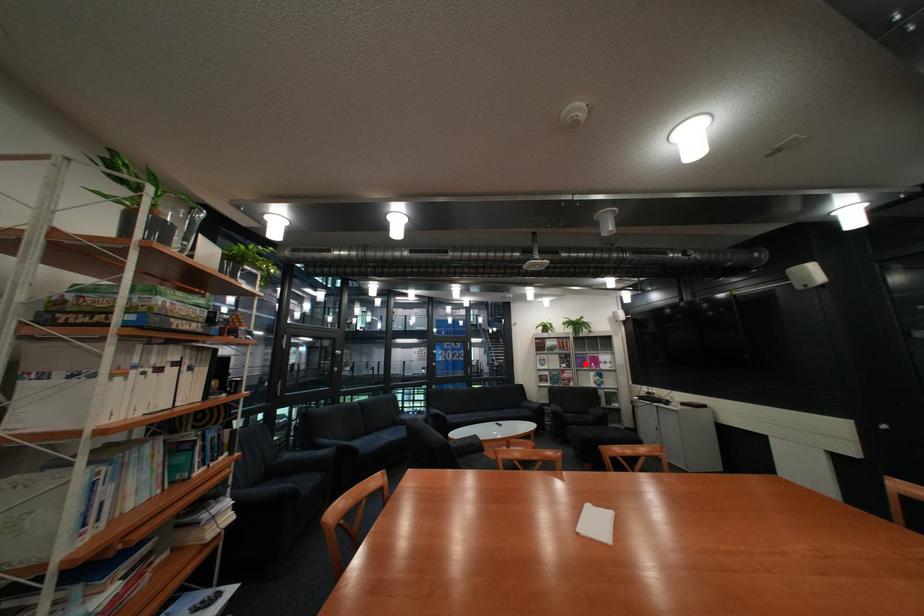
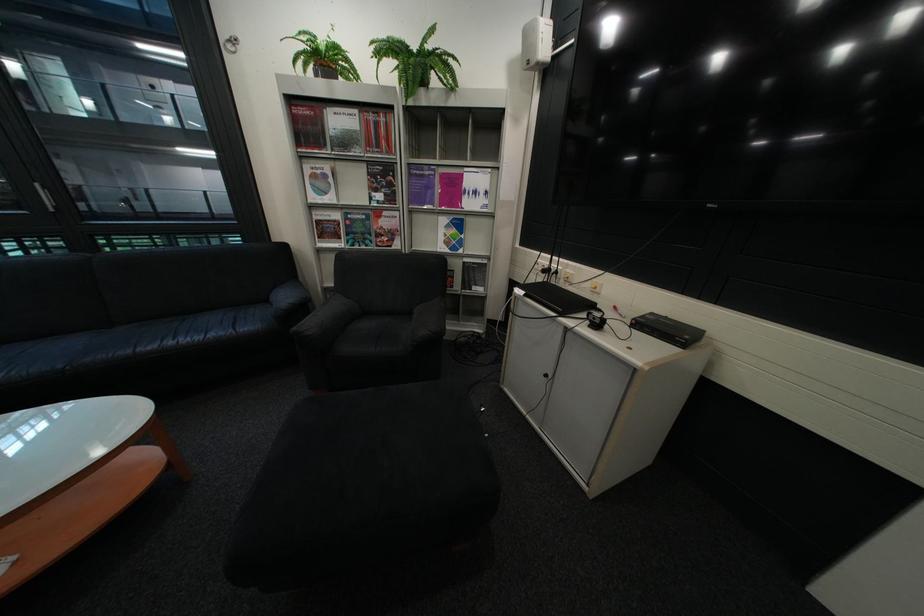
Question: I am providing you with two images of the same scene from different viewpoints. In image1, a red point is highlighted. Considering the same 3D point in image2, which of the following is correct?

Choices:
 (A) It is closer
 (B) It is farther

Answer: (A)